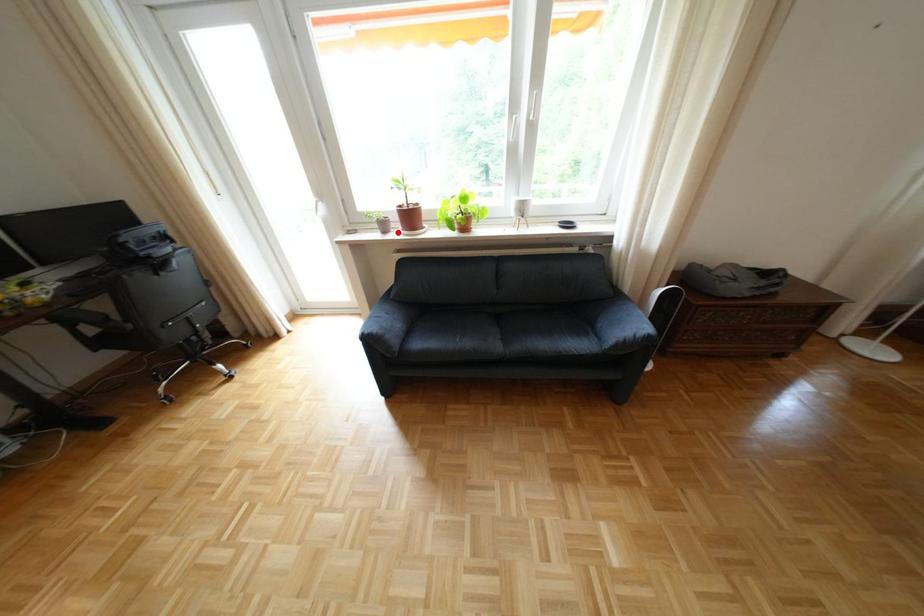
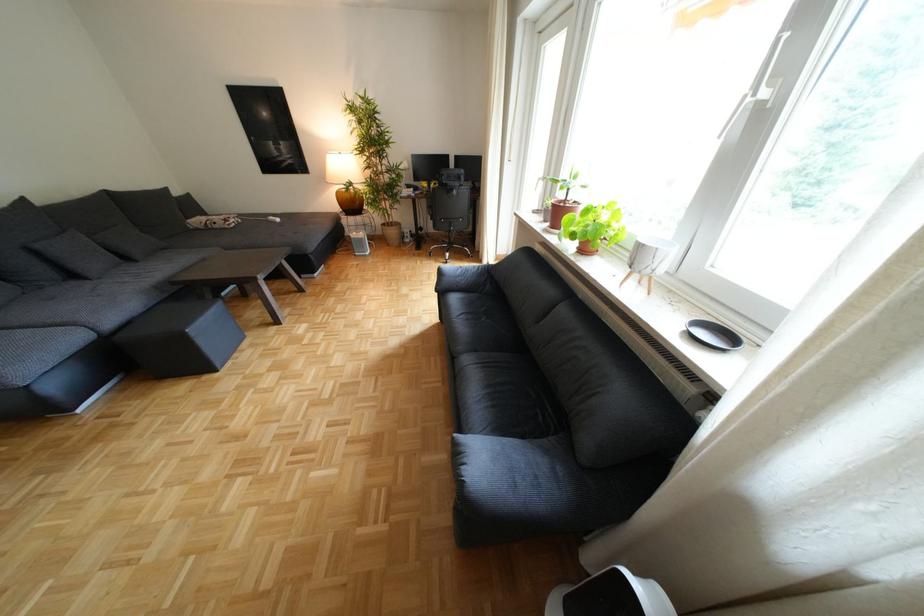
In the second image, find the point that corresponds to the highlighted location in the first image.

(558, 220)